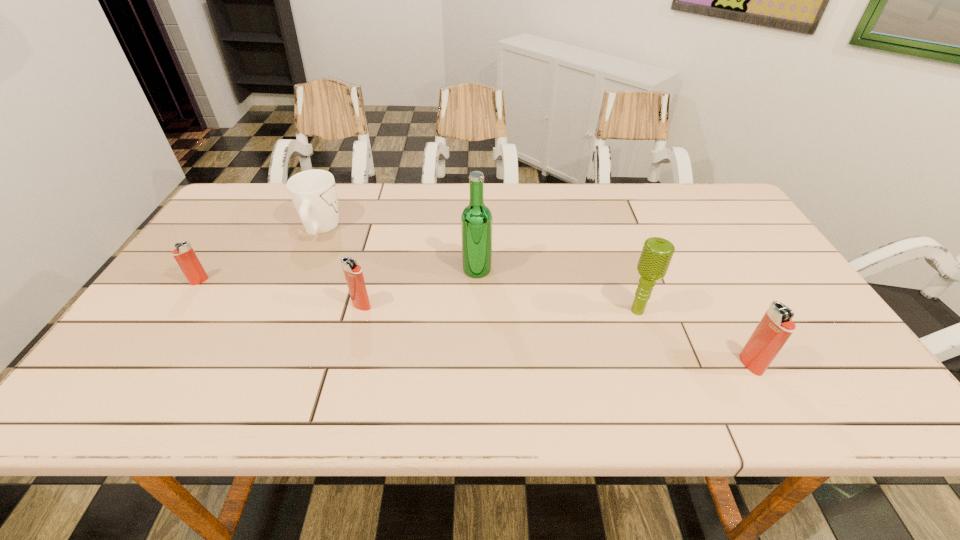
Identify the location of object present at the near edge. (776, 326).

This screenshot has height=540, width=960. Identify the location of object located at the left edge. (184, 254).

In the image, there is a desktop. Where is `vacant space at the far edge`? This screenshot has height=540, width=960. vacant space at the far edge is located at coordinates (592, 189).

In the image, there is a desktop. Find the location of `vacant space at the near edge`. vacant space at the near edge is located at coordinates (558, 346).

I want to click on free spot at the left edge of the desktop, so click(x=232, y=265).

Identify the location of vacant area at the right edge. This screenshot has width=960, height=540. (757, 268).

The width and height of the screenshot is (960, 540). I want to click on vacant space at the near right corner of the desktop, so click(782, 373).

This screenshot has width=960, height=540. I want to click on vacant space that is in between the second object from left to right and the rightmost igniter, so click(x=536, y=297).

You are a GUI agent. You are given a task and a screenshot of the screen. Output one action in this format:
    pyautogui.click(x=<x>, y=<y>)
    Task: Click on the vacant point located between the tallest object and the second object from left to right
    
    Given the screenshot: What is the action you would take?
    pyautogui.click(x=399, y=249)

Where is `vacant point located between the tallest object and the fifth object from left to right`? The image size is (960, 540). vacant point located between the tallest object and the fifth object from left to right is located at coordinates (558, 291).